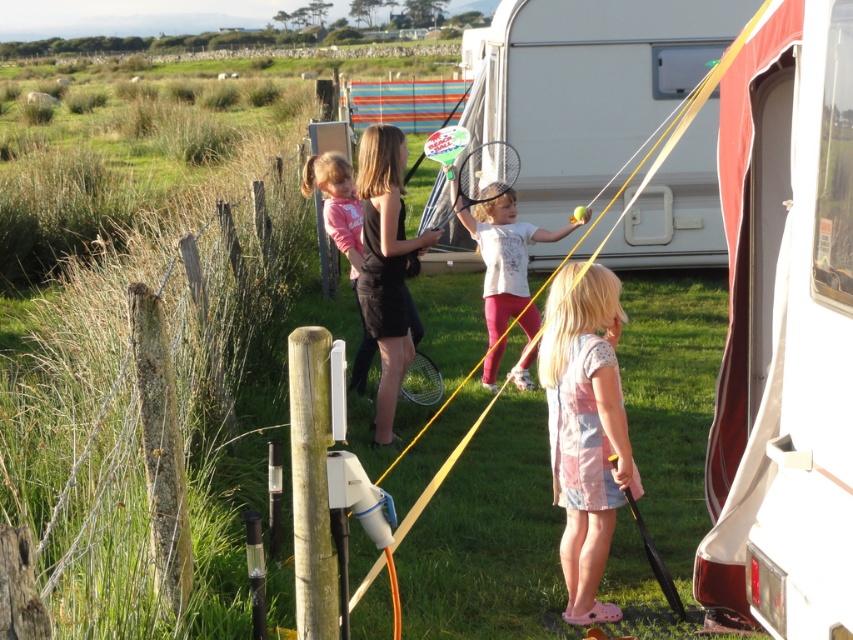
Is white matte tennis racket at center below matte black tennis racket at center?

Indeed, white matte tennis racket at center is positioned under matte black tennis racket at center.

Image resolution: width=853 pixels, height=640 pixels. Describe the element at coordinates (505, 266) in the screenshot. I see `white matte tennis racket at center` at that location.

Who is more distant from viewer, (498, 200) or (498, 192)?

The point (498, 200) is behind.

At what (x,y) coordinates should I click in order to perform the action: click on white matte tennis racket at center. Please return your answer as a coordinate pair (x, y). Looking at the image, I should click on (505, 266).

Between patchwork cotton dress at center and black matte dress at center, which one appears on the left side from the viewer's perspective?

black matte dress at center is more to the left.

Is patchwork cotton dress at center bigger than black matte dress at center?

No.

What do you see at coordinates (585, 428) in the screenshot?
I see `patchwork cotton dress at center` at bounding box center [585, 428].

Find the location of a particular element. This screenshot has width=853, height=640. patchwork cotton dress at center is located at coordinates (585, 428).

Is patchwork cotton dress at center in front of metallic silver racket at center?

That is True.

Between patchwork cotton dress at center and metallic silver racket at center, which one is positioned higher?

metallic silver racket at center is above.

What do you see at coordinates (585, 428) in the screenshot?
I see `patchwork cotton dress at center` at bounding box center [585, 428].

Image resolution: width=853 pixels, height=640 pixels. What are the coordinates of `patchwork cotton dress at center` in the screenshot? It's located at (585, 428).